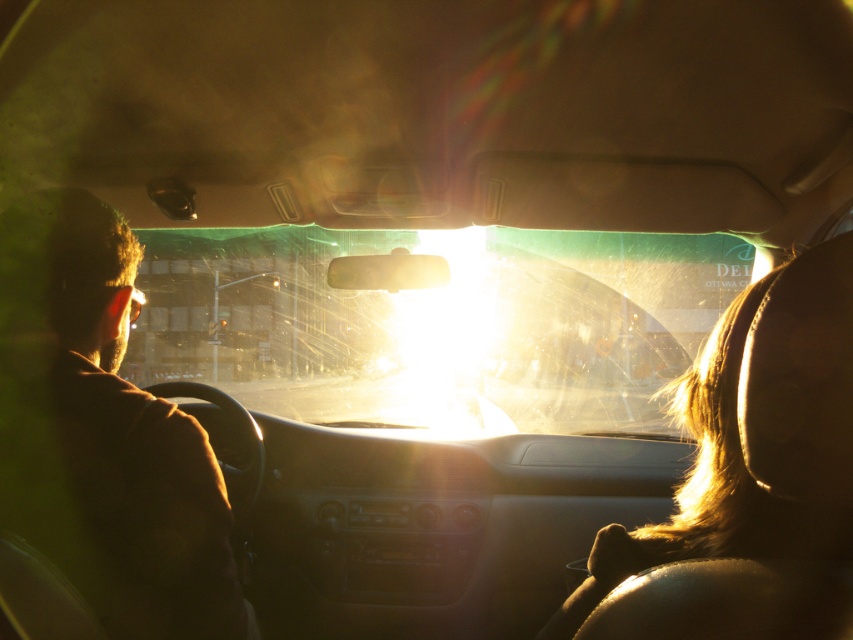
Can you confirm if blonde hair at right is bigger than brown fuzzy jacket at left?

Actually, blonde hair at right might be smaller than brown fuzzy jacket at left.

Is point (735, 545) closer to viewer compared to point (154, 483)?

Yes.

What are the coordinates of `blonde hair at right` in the screenshot? It's located at (747, 480).

Is transparent glass windshield at center positioned at the back of blonde hair at right?

Yes, it is.

Describe the element at coordinates (436, 324) in the screenshot. I see `transparent glass windshield at center` at that location.

Locate an element on the screen. transparent glass windshield at center is located at coordinates (436, 324).

Consider the image. Does transparent glass windshield at center have a greater width compared to brown fuzzy jacket at left?

Yes.

Is transparent glass windshield at center shorter than brown fuzzy jacket at left?

No, transparent glass windshield at center is not shorter than brown fuzzy jacket at left.

Who is more distant from viewer, (550,328) or (83,506)?

Positioned behind is point (550,328).

Identify the location of transparent glass windshield at center. This screenshot has width=853, height=640. (436, 324).